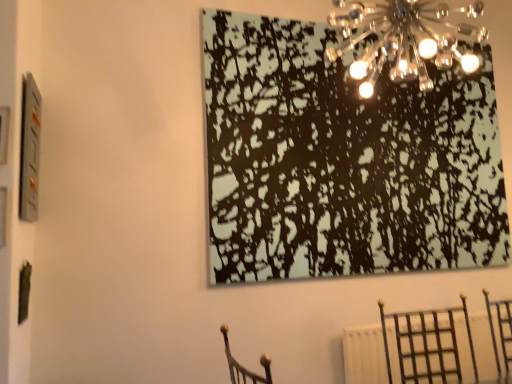
Question: From the image's perspective, is metallic dark brown chair at lower right above or below metallic glass chandelier at upper center?

Choices:
 (A) below
 (B) above

Answer: (A)

Question: Considering the positions of metallic dark brown chair at lower right and metallic glass chandelier at upper center in the image, is metallic dark brown chair at lower right bigger or smaller than metallic glass chandelier at upper center?

Choices:
 (A) small
 (B) big

Answer: (B)

Question: Estimate the real-world distances between objects in this image. Which object is closer to the metallic dark brown chair at lower right?

Choices:
 (A) metallic glass chandelier at upper center
 (B) black textured painting at upper center
 (C) metallic silver picture frame at upper left

Answer: (B)

Question: Which object is positioned farthest from the metallic glass chandelier at upper center?

Choices:
 (A) metallic silver picture frame at upper left
 (B) black textured painting at upper center
 (C) metallic dark brown chair at lower right

Answer: (A)